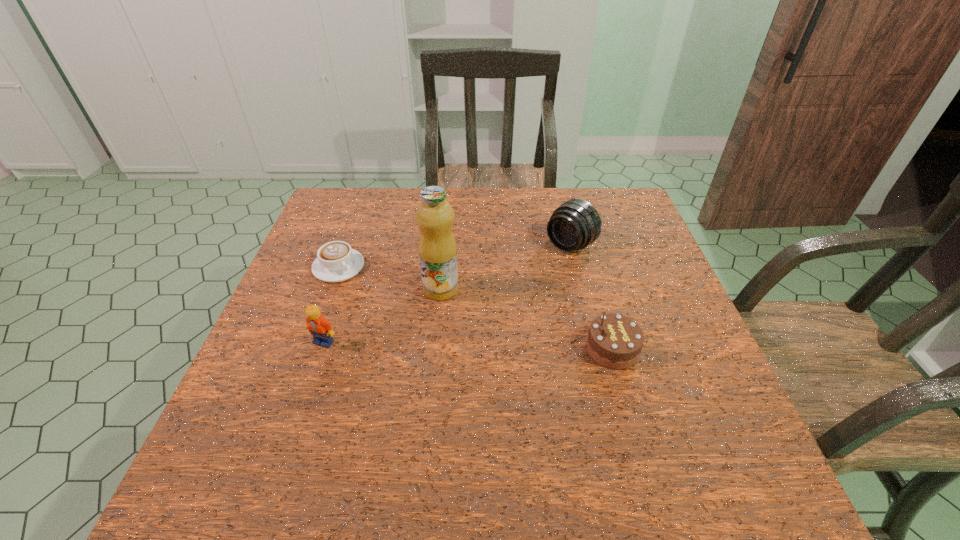
Where is `chocolate cake located in the right edge section of the desktop`? chocolate cake located in the right edge section of the desktop is located at coordinates (614, 341).

Locate an element on the screen. telephoto lens that is at the right edge is located at coordinates (575, 224).

Locate an element on the screen. object that is positioned at the far right corner is located at coordinates (575, 224).

In the image, there is a desktop. Identify the location of free space at the far edge. The image size is (960, 540). (575, 192).

Locate an element on the screen. The width and height of the screenshot is (960, 540). vacant space at the near edge of the desktop is located at coordinates (648, 412).

You are a GUI agent. You are given a task and a screenshot of the screen. Output one action in this format:
    pyautogui.click(x=<x>, y=<y>)
    Task: Click on the vacant space at the left edge
    The image size is (960, 540).
    Given the screenshot: What is the action you would take?
    pyautogui.click(x=299, y=335)

The image size is (960, 540). I want to click on vacant space at the right edge of the desktop, so click(648, 249).

Find the location of `free space at the far right corner`. free space at the far right corner is located at coordinates (604, 226).

Identify the location of vacant space at the near right corner. (738, 424).

Image resolution: width=960 pixels, height=540 pixels. I want to click on empty location between the fourth tallest object and the cappuccino, so click(x=475, y=308).